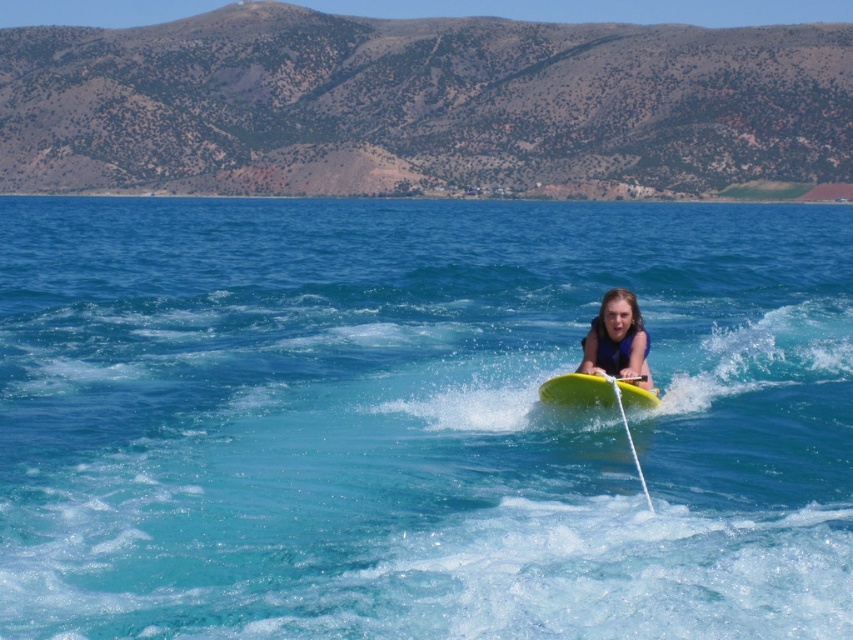
Question: Does matte yellow surfboard at center have a larger size compared to yellow foam surfboard at center?

Choices:
 (A) no
 (B) yes

Answer: (B)

Question: Which point is closer to the camera?

Choices:
 (A) (267, 497)
 (B) (553, 381)

Answer: (A)

Question: Does translucent blue water at center appear on the right side of matte yellow surfboard at center?

Choices:
 (A) yes
 (B) no

Answer: (B)

Question: Considering the real-world distances, which object is farthest from the translucent blue water at center?

Choices:
 (A) yellow foam surfboard at center
 (B) matte yellow surfboard at center

Answer: (B)

Question: Which of the following is the farthest from the observer?

Choices:
 (A) matte yellow surfboard at center
 (B) yellow foam surfboard at center

Answer: (A)

Question: Is translucent blue water at center further to camera compared to matte yellow surfboard at center?

Choices:
 (A) yes
 (B) no

Answer: (B)